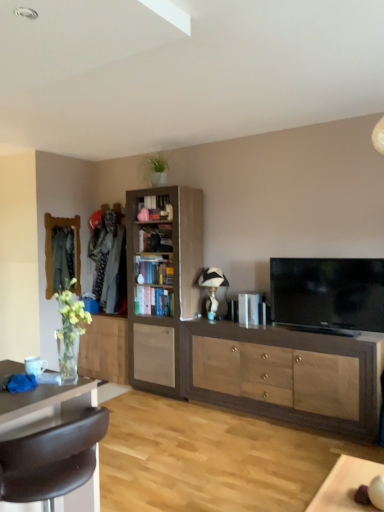
Question: Considering the relative sizes of wooden bookshelf at center, which appears as the 1th shelf when viewed from the top, and light brown wood cabinet at center, which is the first cabinetry in left-to-right order, in the image provided, is wooden bookshelf at center, which appears as the 1th shelf when viewed from the top, smaller than light brown wood cabinet at center, which is the first cabinetry in left-to-right order,?

Choices:
 (A) yes
 (B) no

Answer: (A)

Question: Is wooden bookshelf at center, which ranks as the second shelf in bottom-to-top order, aimed at light brown wood cabinet at center, marked as the third cabinetry in a right-to-left arrangement?

Choices:
 (A) no
 (B) yes

Answer: (A)

Question: Does wooden bookshelf at center, which ranks as the second shelf in bottom-to-top order, have a lesser height compared to light brown wood cabinet at center, which is the first cabinetry in left-to-right order?

Choices:
 (A) no
 (B) yes

Answer: (B)

Question: From the image's perspective, does wooden bookshelf at center, which ranks as the second shelf in bottom-to-top order, appear higher than light brown wood cabinet at center, marked as the third cabinetry in a right-to-left arrangement?

Choices:
 (A) yes
 (B) no

Answer: (A)

Question: Is light brown wood cabinet at center, marked as the third cabinetry in a right-to-left arrangement, located within wooden bookshelf at center, which ranks as the second shelf in bottom-to-top order?

Choices:
 (A) yes
 (B) no

Answer: (B)

Question: Does wooden bookshelf at center, which appears as the 1th shelf when viewed from the top, appear on the right side of light brown wood cabinet at center, which is the first cabinetry in left-to-right order?

Choices:
 (A) yes
 (B) no

Answer: (A)

Question: Could you tell me if matte wood cabinet at center, which appears as the 3th cabinetry when viewed from the left, is turned towards matte wooden mirror at left?

Choices:
 (A) no
 (B) yes

Answer: (A)

Question: Considering the relative sizes of matte wood cabinet at center, which appears as the 3th cabinetry when viewed from the left, and matte wooden mirror at left in the image provided, is matte wood cabinet at center, which appears as the 3th cabinetry when viewed from the left, smaller than matte wooden mirror at left?

Choices:
 (A) yes
 (B) no

Answer: (B)

Question: Is matte wood cabinet at center, positioned as the 1th cabinetry in right-to-left order, bigger than matte wooden mirror at left?

Choices:
 (A) no
 (B) yes

Answer: (B)

Question: Are matte wood cabinet at center, which appears as the 3th cabinetry when viewed from the left, and matte wooden mirror at left far apart?

Choices:
 (A) no
 (B) yes

Answer: (B)

Question: Is matte wood cabinet at center, which appears as the 3th cabinetry when viewed from the left, located outside matte wooden mirror at left?

Choices:
 (A) yes
 (B) no

Answer: (A)

Question: Does matte wood cabinet at center, which appears as the 3th cabinetry when viewed from the left, come behind matte wooden mirror at left?

Choices:
 (A) yes
 (B) no

Answer: (B)

Question: Does brown leather chair at lower left have a lesser height compared to flat screen tv at right?

Choices:
 (A) no
 (B) yes

Answer: (A)